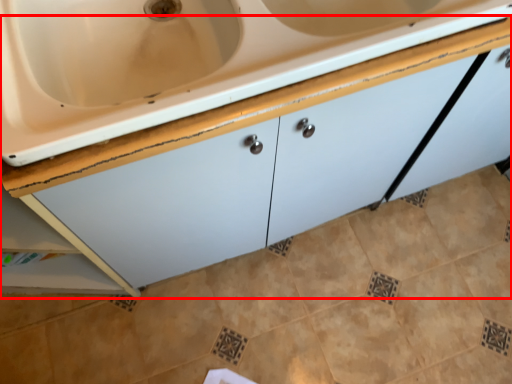
Question: Considering the relative positions of cabinetry (annotated by the red box) and ceramic tile in the image provided, where is cabinetry (annotated by the red box) located with respect to the staircase?

Choices:
 (A) left
 (B) right

Answer: (A)